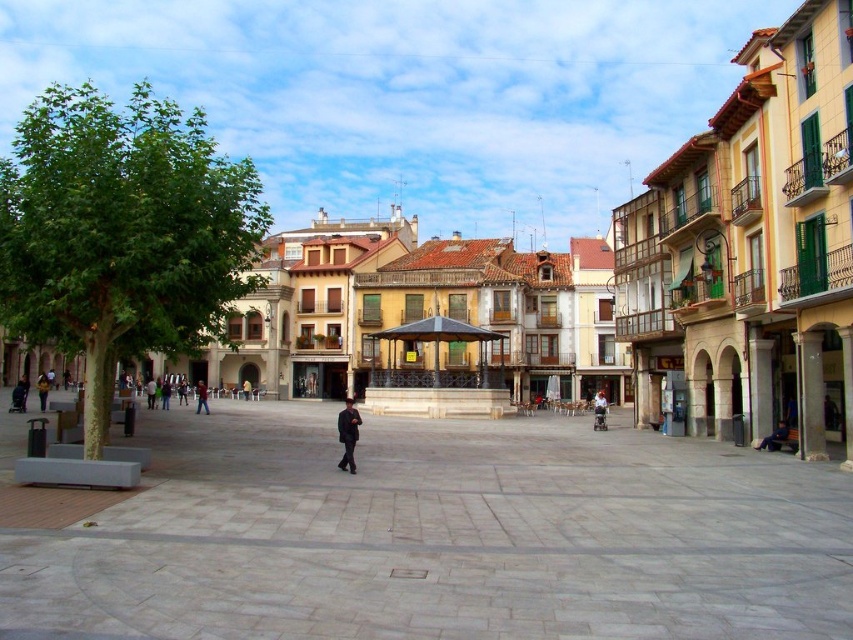
You are standing in the plaza and want to place the dark brown leather jacket at lower left on top of the smooth concrete plaza at center. Is this possible?

The smooth concrete plaza at center has a greater height compared to dark brown leather jacket at lower left, so the jacket can be placed on top since it is smaller in height.

You are an architect designing a new plaza and want to ensure that the central feature is smaller than the seating area. Based on the plaza shown, does the smooth stone square at center meet this requirement when compared to the dark brown leather jacket at lower left?

The smooth stone square at center occupies less space than the dark brown leather jacket at lower left, so it meets the requirement of being smaller than the seating area.